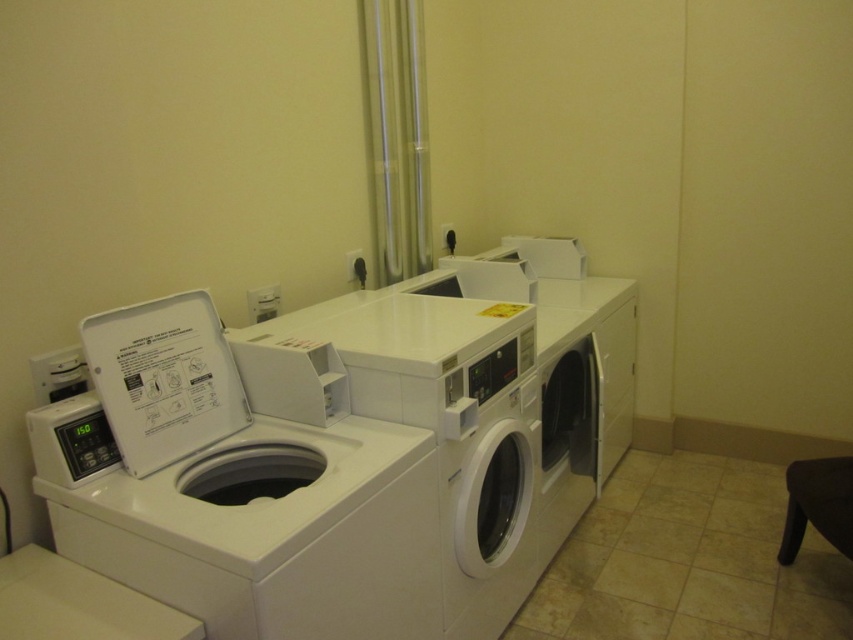
From the picture: You are moving a black leather stool at lower right into the laundry room and need to place it next to the white plastic washer at left. Considering their sizes, will the stool fit comfortably next to the washer without blocking the control panel?

The white plastic washer at left is wider than the black leather stool at lower right. Since the washer is wider, there should be enough space to place the stool next to it without blocking the control panel, as the stool is narrower.

You are standing in front of the two washing machines in the laundry room. There are two points marked on the machines. The first point is at coordinates point (287, 401) and the second is at point (827, 460). If you were to reach out to touch one of these points, which one would require you to stretch your arm less?

Point (287, 401) is closer to the viewer than point (827, 460), so you would need to stretch your arm less to touch point (287, 401).